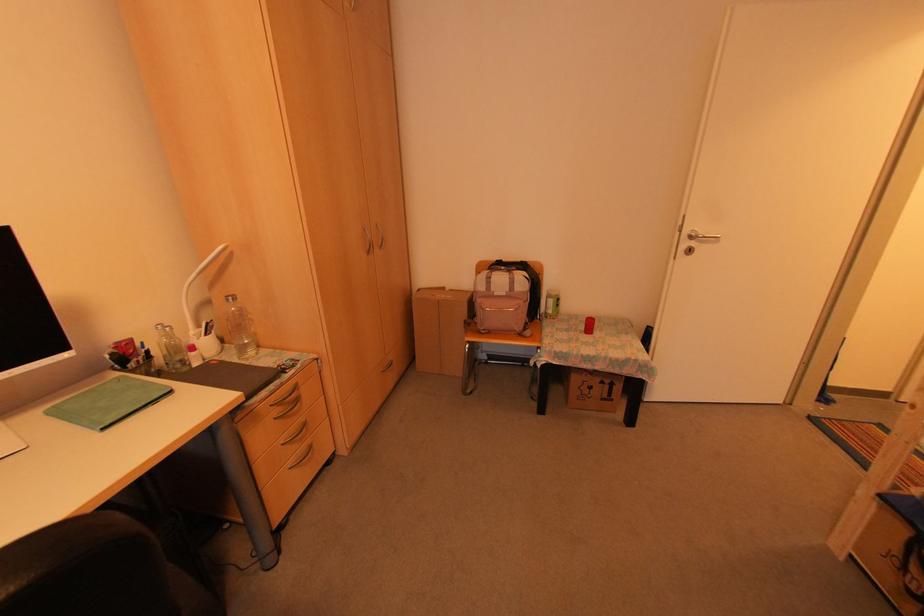
Locate an element on the screen. small green bottle is located at coordinates (551, 304).